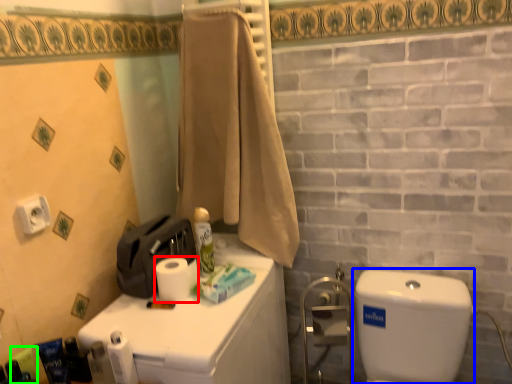
Question: Based on their relative distances, which object is farther from toilet paper (highlighted by a red box)? Choose from water tank (highlighted by a blue box) and toiletry (highlighted by a green box).

Choices:
 (A) water tank
 (B) toiletry

Answer: (A)